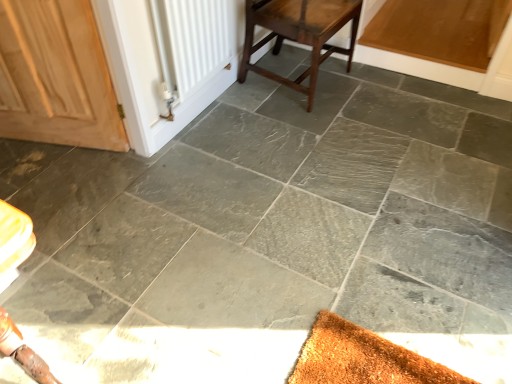
You are a GUI agent. You are given a task and a screenshot of the screen. Output one action in this format:
    pyautogui.click(x=<x>, y=<y>)
    Task: Click on the free space in front of dark brown wood stool at center
    
    Given the screenshot: What is the action you would take?
    pyautogui.click(x=306, y=130)